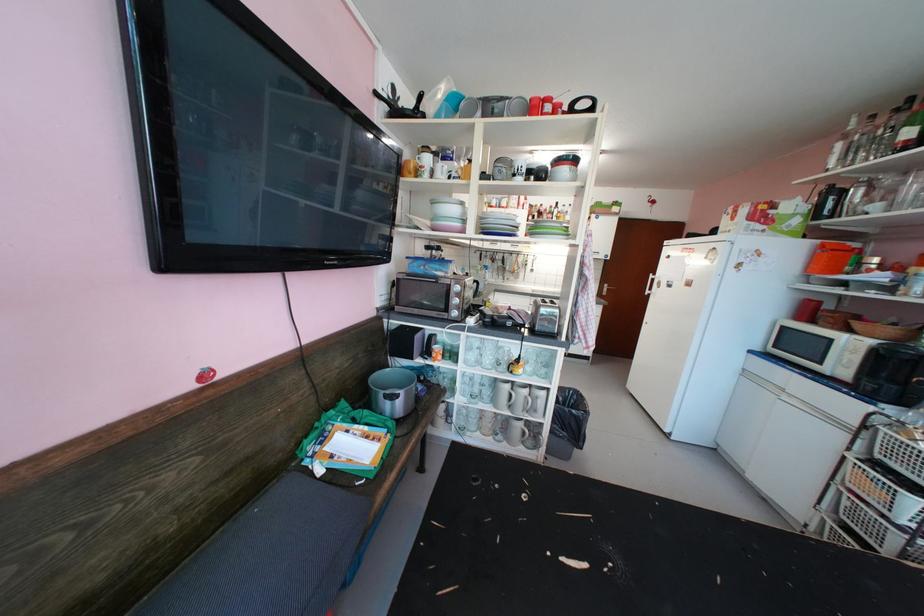
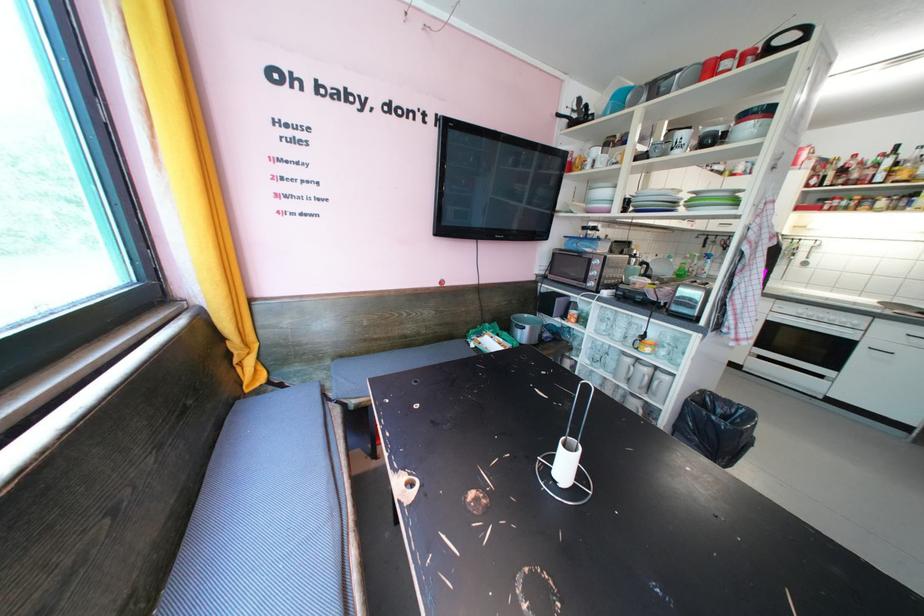
Question: I am providing you with two images of the same scene from different viewpoints. Please identify which objects are invisible in image2.

Choices:
 (A) black trash bag
 (B) glass mug handle
 (C) oven door handle
 (D) none of these

Answer: (D)